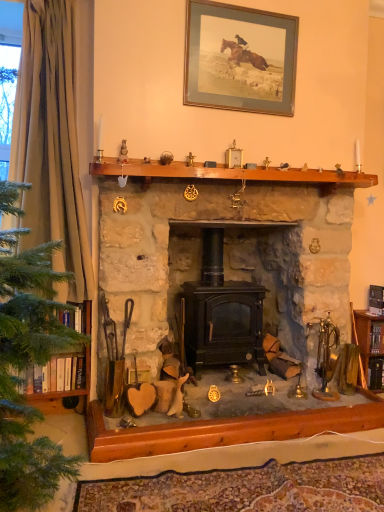
Question: From a real-world perspective, relative to green fabric curtain at left, is brown wooden mantle at upper center vertically above or below?

Choices:
 (A) below
 (B) above

Answer: (A)

Question: From their relative heights in the image, would you say brown wooden mantle at upper center is taller or shorter than green fabric curtain at left?

Choices:
 (A) tall
 (B) short

Answer: (B)

Question: Which of these objects is positioned farthest from the green fabric curtain at left?

Choices:
 (A) gold-framed print at upper center
 (B) matte black wood-burning stove at center
 (C) brown wooden mantle at upper center

Answer: (A)

Question: Which of these objects is positioned farthest from the green fabric curtain at left?

Choices:
 (A) matte black wood-burning stove at center
 (B) brown wooden mantle at upper center
 (C) gold-framed print at upper center

Answer: (C)